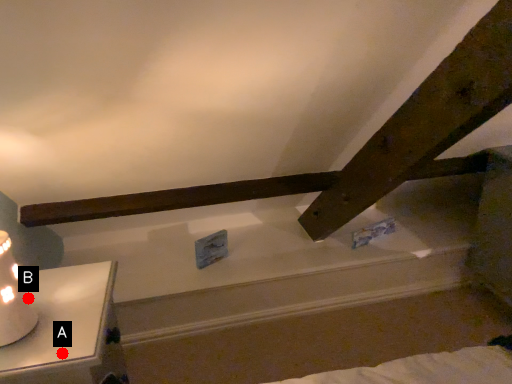
Question: Two points are circled on the image, labeled by A and B beside each circle. Which point is closer to the camera taking this photo?

Choices:
 (A) A is closer
 (B) B is closer

Answer: (A)